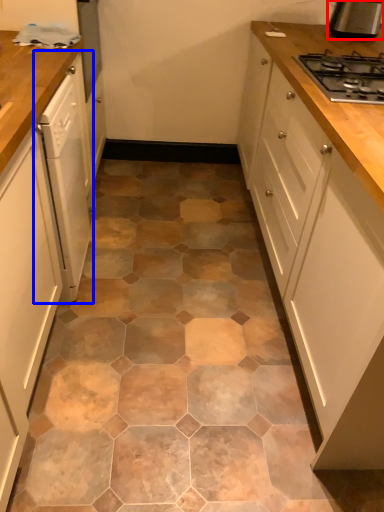
Question: Which of the following is the farthest to the observer, kitchen appliance (highlighted by a red box) or home appliance (highlighted by a blue box)?

Choices:
 (A) kitchen appliance
 (B) home appliance

Answer: (A)